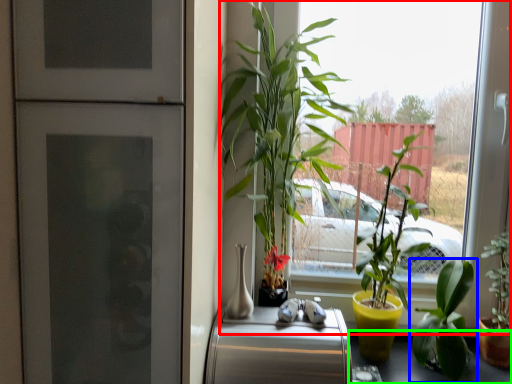
Question: Which is nearer to the window (highlighted by a red box)? houseplant (highlighted by a blue box) or table (highlighted by a green box).

Choices:
 (A) houseplant
 (B) table

Answer: (A)